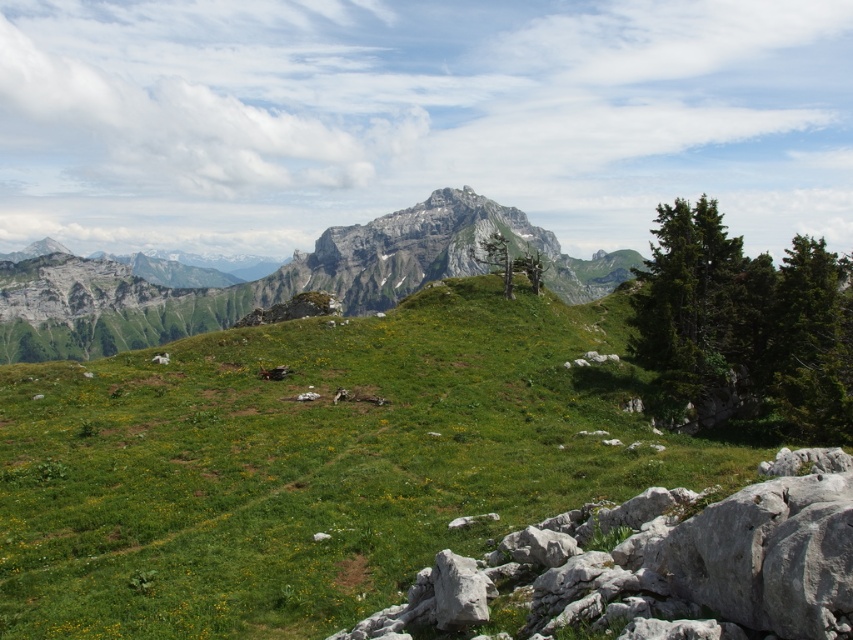
You are a hiker trying to navigate through the mountainous landscape. You need to decide whether to place your tent on the white rock at lower right or the rugged stone mountain at center. Which location provides more space for your tent?

The rugged stone mountain at center occupies more space than the white rock at lower right, so placing your tent on the rugged stone mountain at center would provide more space.

You are hiking and come across a grassy hill with small yellow flowers. You see a white rock at lower right and a rugged stone mountain at center. Which object is positioned to the left of the other?

The white rock at lower right is to the left of rugged stone mountain at center.

You are hiking and want to reach the rugged stone mountain at center from the green grassy hillside at center. Which direction should you head?

To reach the rugged stone mountain at center from the green grassy hillside at center, you should head to the right since the green grassy hillside at center is located to the left of the rugged stone mountain at center.